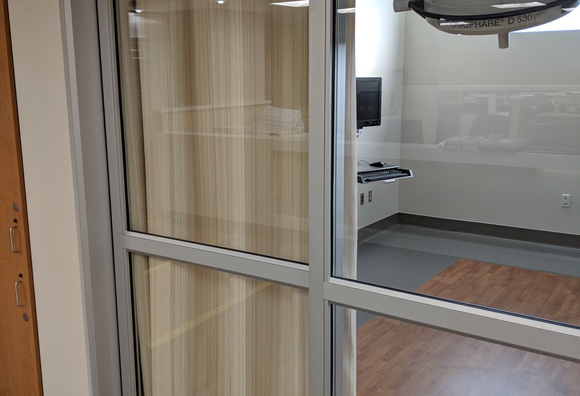
Where is `white wall in room behind window glass`? white wall in room behind window glass is located at coordinates (566, 219), (432, 200), (554, 136), (430, 119), (435, 44), (554, 48), (371, 26), (390, 108), (365, 151), (364, 208).